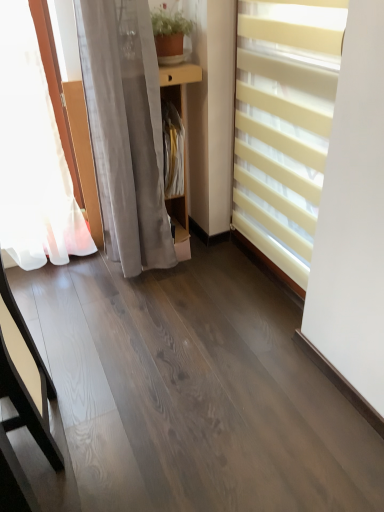
Question: Considering the relative sizes of wooden shelf at center and matte yellow blinds at right in the image provided, is wooden shelf at center taller than matte yellow blinds at right?

Choices:
 (A) yes
 (B) no

Answer: (B)

Question: Does wooden shelf at center lie in front of matte yellow blinds at right?

Choices:
 (A) no
 (B) yes

Answer: (A)

Question: Can you confirm if wooden shelf at center is bigger than matte yellow blinds at right?

Choices:
 (A) yes
 (B) no

Answer: (B)

Question: Is wooden shelf at center shorter than matte yellow blinds at right?

Choices:
 (A) no
 (B) yes

Answer: (B)

Question: Is wooden shelf at center completely or partially outside of matte yellow blinds at right?

Choices:
 (A) yes
 (B) no

Answer: (A)

Question: Considering their positions, is light brown wood table at left located in front of or behind matte yellow blinds at right?

Choices:
 (A) behind
 (B) front

Answer: (B)

Question: Does point [26, 325] appear closer or farther from the camera than point [236, 58]?

Choices:
 (A) closer
 (B) farther

Answer: (B)

Question: Looking at the image, does light brown wood table at left seem bigger or smaller compared to matte yellow blinds at right?

Choices:
 (A) small
 (B) big

Answer: (A)

Question: Is light brown wood table at left spatially inside matte yellow blinds at right, or outside of it?

Choices:
 (A) inside
 (B) outside

Answer: (B)

Question: Is wooden shelf at center taller or shorter than sheer white curtain at left?

Choices:
 (A) short
 (B) tall

Answer: (A)

Question: From a real-world perspective, is wooden shelf at center physically located above or below sheer white curtain at left?

Choices:
 (A) above
 (B) below

Answer: (B)

Question: From the image's perspective, is wooden shelf at center positioned above or below sheer white curtain at left?

Choices:
 (A) below
 (B) above

Answer: (B)

Question: Is wooden shelf at center in front of or behind sheer white curtain at left in the image?

Choices:
 (A) behind
 (B) front

Answer: (A)

Question: Based on their sizes in the image, would you say matte yellow blinds at right is bigger or smaller than sheer white curtain at left?

Choices:
 (A) small
 (B) big

Answer: (A)

Question: Is matte yellow blinds at right inside or outside of sheer white curtain at left?

Choices:
 (A) outside
 (B) inside

Answer: (A)